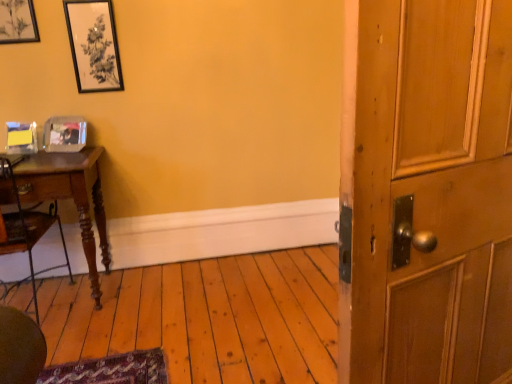
Where is `free location to the right of wooden desk at left`? free location to the right of wooden desk at left is located at coordinates (155, 297).